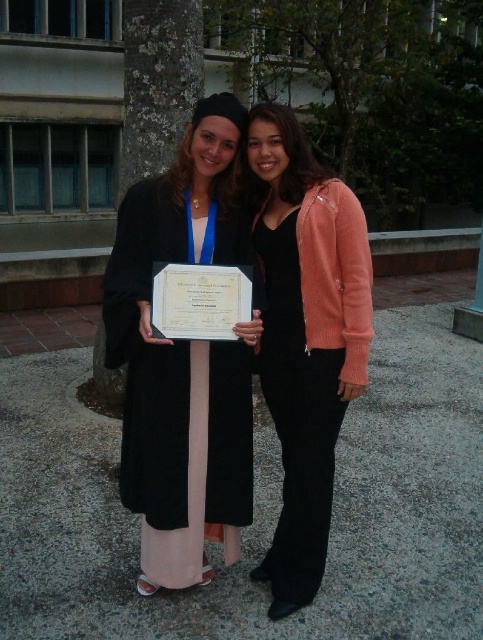
You are a photographer trying to capture a closeup shot of both the matte black graduation gown at center and the matte pink sweater at center. Since you want to ensure both are fully visible in the frame, which object should you adjust your camera angle to focus on first?

The matte black graduation gown at center is wider than the matte pink sweater at center, so you should focus on the matte black graduation gown at center first to ensure it fits within the frame.

You are a photographer taking a picture of the matte black graduation gown at center and the matte pink sweater at center. Which one should you focus on first if you want to capture both in focus?

The matte black graduation gown at center is taller than the matte pink sweater at center, so you should focus on the matte black graduation gown at center first to ensure both are in focus.